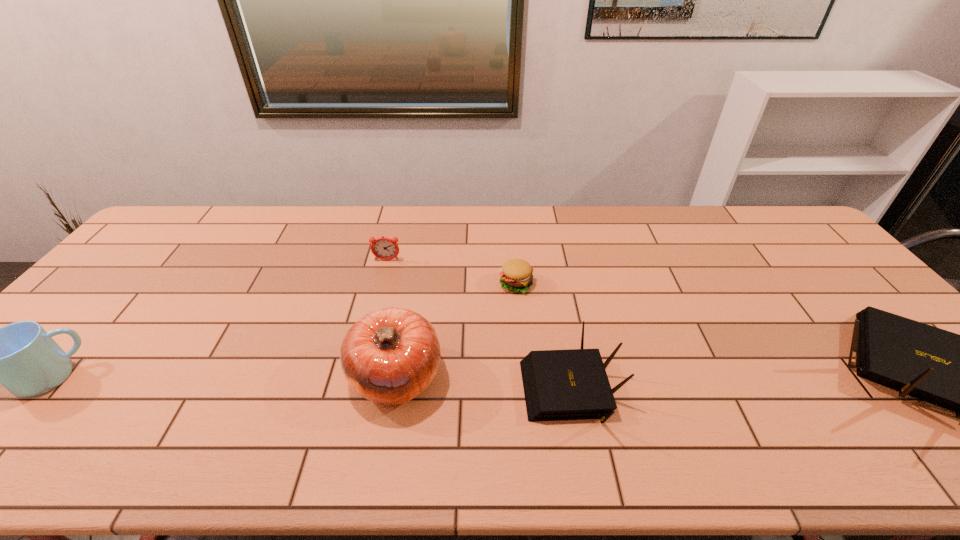
The height and width of the screenshot is (540, 960). What are the coordinates of `the left router` in the screenshot? It's located at (572, 384).

Where is `the farthest object`? The width and height of the screenshot is (960, 540). the farthest object is located at coordinates (383, 248).

Where is `the shortest object`? the shortest object is located at coordinates (516, 275).

Identify the location of the fifth nearest object. (516, 275).

Where is `pumpkin`? pumpkin is located at coordinates (390, 356).

The image size is (960, 540). I want to click on vacant space situated 0.310m on the right of the left router, so click(753, 389).

At what (x,y) coordinates should I click in order to perform the action: click on vacant space situated 0.320m on the front-facing side of the alarm clock. Please return your answer as a coordinate pair (x, y). This screenshot has width=960, height=540. Looking at the image, I should click on (367, 340).

I want to click on vacant space located on the back of the shortest object, so click(512, 235).

Image resolution: width=960 pixels, height=540 pixels. Find the location of `vacant region located 0.160m on the left of the pumpkin`. vacant region located 0.160m on the left of the pumpkin is located at coordinates (281, 376).

You are a GUI agent. You are given a task and a screenshot of the screen. Output one action in this format:
    pyautogui.click(x=<x>, y=<y>)
    Task: Click on the router present at the near edge
    The image size is (960, 540).
    Given the screenshot: What is the action you would take?
    pyautogui.click(x=572, y=384)